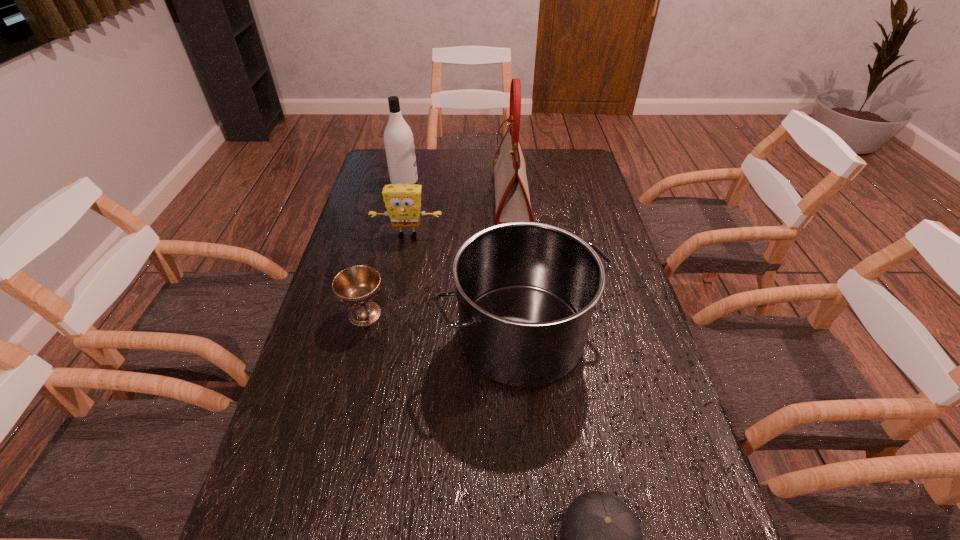
I want to click on blank space that satisfies the following two spatial constraints: 1. on the front side of the chalice; 2. on the right side of the saucepan, so click(x=359, y=337).

This screenshot has height=540, width=960. What are the coordinates of `free location that satisfies the following two spatial constraints: 1. on the face of the third tallest object; 2. on the right side of the fourth tallest object` in the screenshot? It's located at (389, 337).

The width and height of the screenshot is (960, 540). I want to click on free location that satisfies the following two spatial constraints: 1. on the back side of the chalice; 2. on the right side of the tallest object, so click(394, 197).